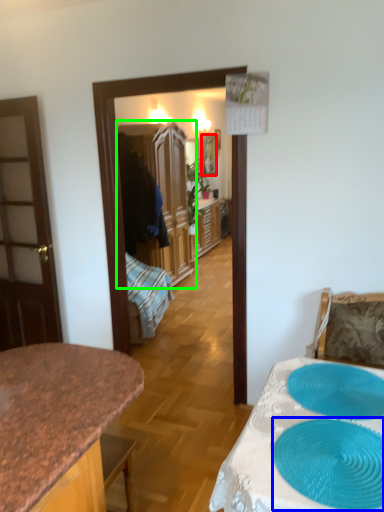
Question: Based on their relative distances, which object is farther from picture frame (highlighted by a red box)? Choose from oval (highlighted by a blue box) and cabinetry (highlighted by a green box).

Choices:
 (A) oval
 (B) cabinetry

Answer: (A)